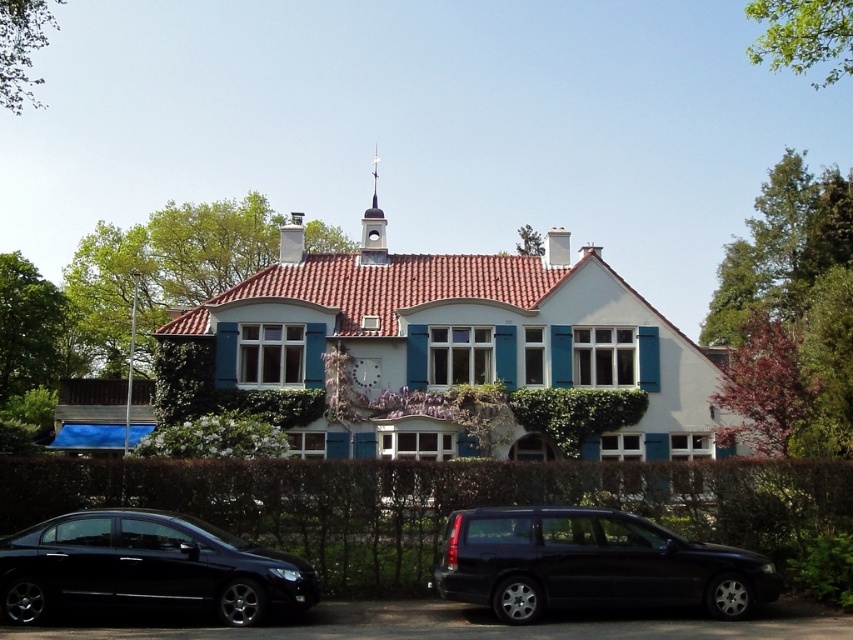
Which is behind, point (247, 532) or point (521, 595)?

Point (247, 532)

Between point (463, 499) and point (659, 554), which one is positioned behind?

The point (463, 499) is more distant.

Identify the location of green hedge at lower center. The width and height of the screenshot is (853, 640). (434, 502).

Does green hedge at lower center have a smaller size compared to black glossy sedan at lower left?

No.

Is point (15, 513) positioned before point (35, 525)?

No, (15, 513) is behind (35, 525).

I want to click on green hedge at lower center, so click(x=434, y=502).

Does black metallic car at lower center have a greater width compared to black glossy sedan at lower left?

Yes, black metallic car at lower center is wider than black glossy sedan at lower left.

Looking at this image, does black metallic car at lower center have a larger size compared to black glossy sedan at lower left?

Yes, black metallic car at lower center is bigger than black glossy sedan at lower left.

At what (x,y) coordinates should I click in order to perform the action: click on black metallic car at lower center. Please return your answer as a coordinate pair (x, y). Looking at the image, I should click on (590, 563).